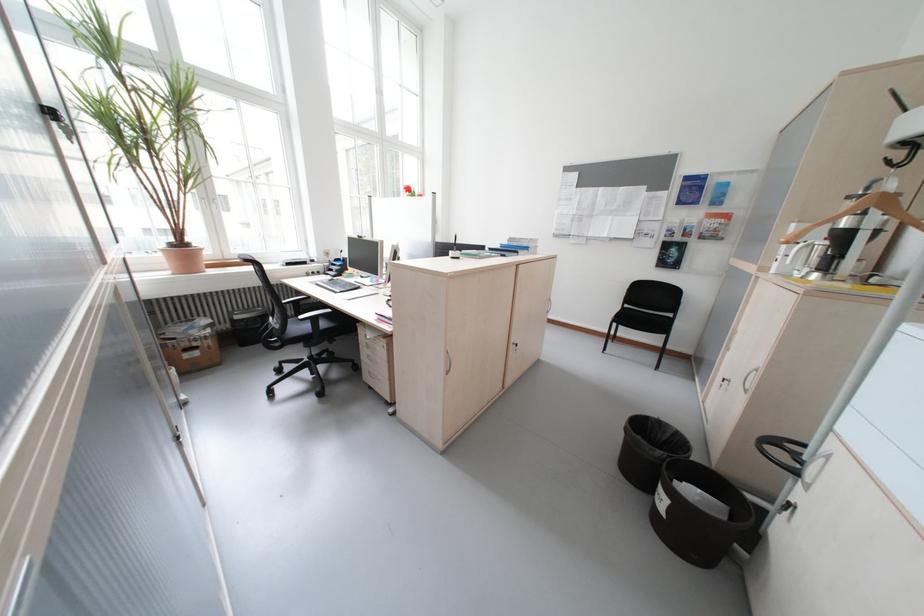
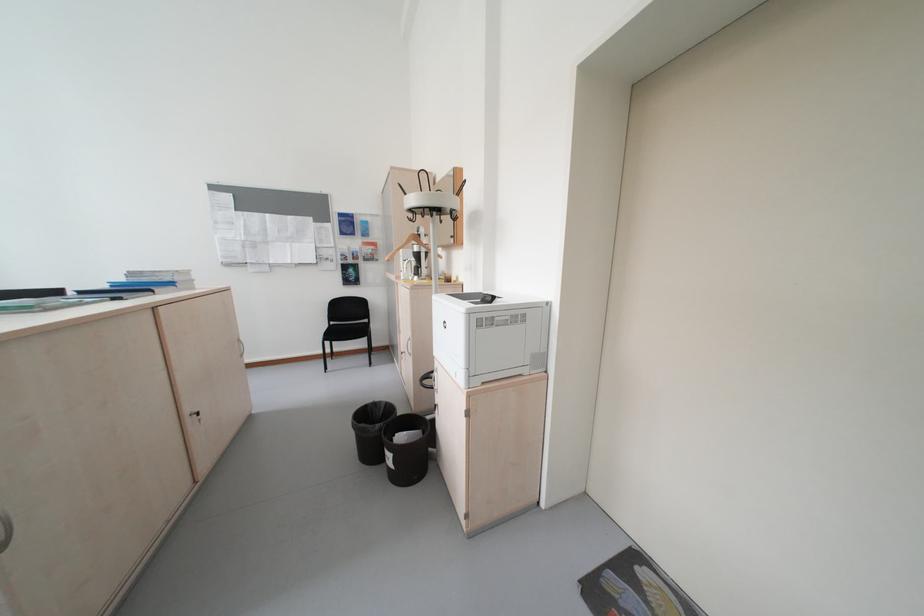
The point at (637, 307) is marked in the first image. Where is the corresponding point in the second image?

(343, 323)